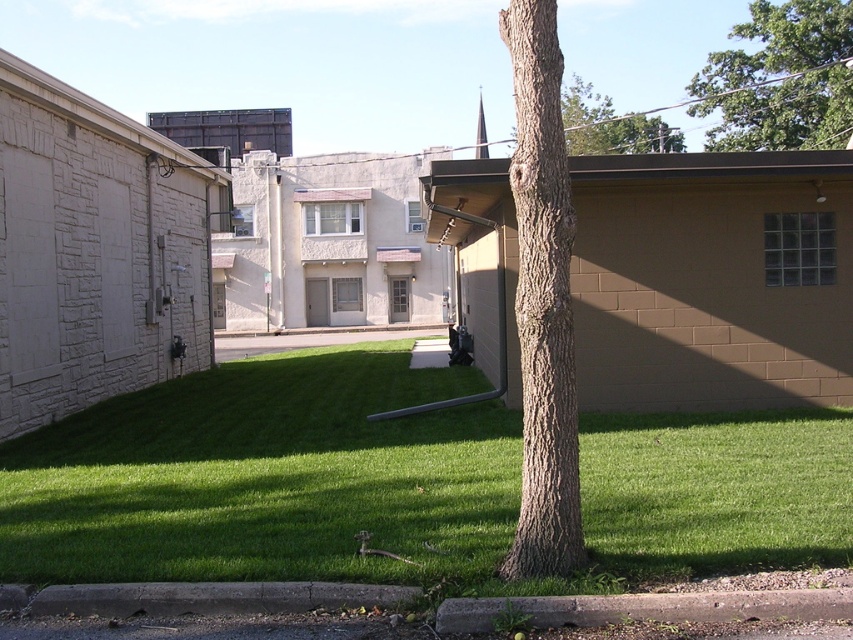
You are a gardener planning to plant a new flower bed. You have two options for locations based on the image. The first is near the green grass at center, and the second is near the green leafy tree at upper right. Which location would you choose to ensure the flowers receive adequate sunlight, and why?

The green grass at center is positioned under the green leafy tree at upper right, which means it is shaded by the tree. Therefore, planting flowers near the green grass at center might not provide enough sunlight. Instead, choosing the area near the green leafy tree at upper right would likely offer better sunlight exposure since it is the source of the shadow cast over the grass.

You are standing on the grassy area and want to take a photo of the brown rough bark tree trunk at center and the green leafy tree at upper right. Which tree is closer to the ground?

The brown rough bark tree trunk at center is closer to the ground because it is below the green leafy tree at upper right.